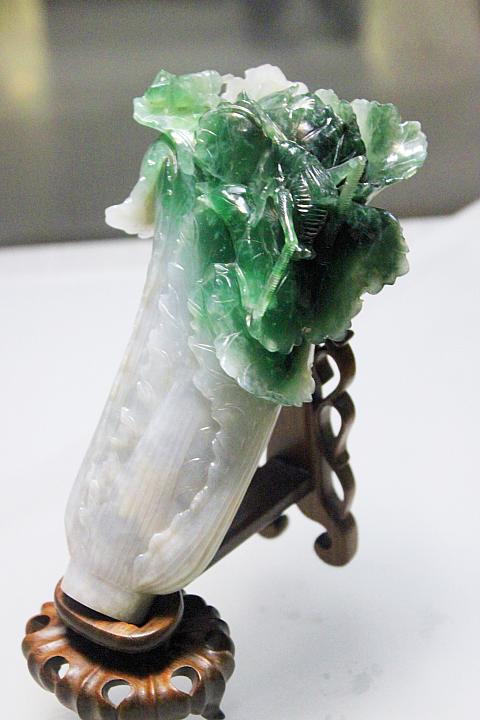
The height and width of the screenshot is (720, 480). I want to click on attached connector/support to wall, so click(x=301, y=454).